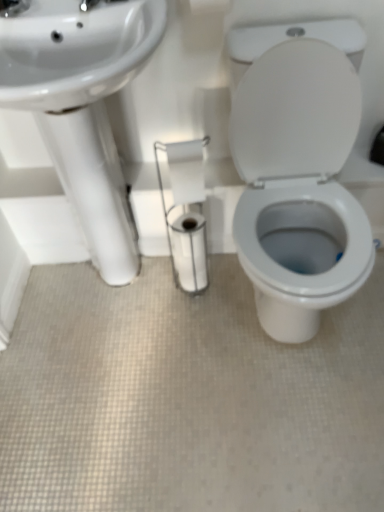
Locate an element on the screen. white glossy toilet paper at center, which ranks as the 2th toilet paper in top-to-bottom order is located at coordinates [x=186, y=170].

The width and height of the screenshot is (384, 512). What do you see at coordinates (186, 170) in the screenshot?
I see `white glossy toilet paper at center, the 1th toilet paper positioned from the bottom` at bounding box center [186, 170].

You are a GUI agent. You are given a task and a screenshot of the screen. Output one action in this format:
    pyautogui.click(x=<x>, y=<y>)
    Task: Click on the white matte toilet paper at upper center, which appears as the second toilet paper when ordered from the bottom
    
    Given the screenshot: What is the action you would take?
    pyautogui.click(x=209, y=6)

Describe the element at coordinates (81, 104) in the screenshot. I see `white glossy sink at left` at that location.

Find the location of a particular element. Image resolution: width=384 pixels, height=512 pixels. white glossy toilet paper at center, the 1th toilet paper positioned from the bottom is located at coordinates (186, 170).

From a real-world perspective, which is physically below, white matte toilet paper at upper center, which appears as the second toilet paper when ordered from the bottom, or white glossy porcelain at center?

white glossy porcelain at center is physically lower.

In the scene shown: Is white matte toilet paper at upper center, which appears as the second toilet paper when ordered from the bottom, in front of or behind white glossy porcelain at center in the image?

In the image, white matte toilet paper at upper center, which appears as the second toilet paper when ordered from the bottom, appears behind white glossy porcelain at center.

Which object is wider, white matte toilet paper at upper center, which appears as the second toilet paper when ordered from the bottom, or white glossy porcelain at center?

With larger width is white glossy porcelain at center.

From the image's perspective, is white matte toilet paper at upper center, which appears as the second toilet paper when ordered from the bottom, above white glossy porcelain at center?

Yes.

Can you see white glossy porcelain at center touching white glossy toilet paper at center, the 1th toilet paper positioned from the bottom?

No, white glossy porcelain at center is not with white glossy toilet paper at center, the 1th toilet paper positioned from the bottom.

Is point (335, 234) positioned in front of point (180, 144)?

No, (335, 234) is behind (180, 144).

Does white glossy porcelain at center have a larger size compared to white glossy toilet paper at center, which ranks as the 2th toilet paper in top-to-bottom order?

Indeed, white glossy porcelain at center has a larger size compared to white glossy toilet paper at center, which ranks as the 2th toilet paper in top-to-bottom order.

Which is correct: white glossy sink at left is inside white glossy toilet paper at center, which ranks as the 2th toilet paper in top-to-bottom order, or outside of it?

white glossy sink at left is spatially situated outside white glossy toilet paper at center, which ranks as the 2th toilet paper in top-to-bottom order.

How much distance is there between white glossy sink at left and white glossy toilet paper at center, the 1th toilet paper positioned from the bottom?

white glossy sink at left and white glossy toilet paper at center, the 1th toilet paper positioned from the bottom, are 11.16 inches apart from each other.

Where is `the 1st toilet paper to the right of the white glossy sink at left, counting from the anchor's position`? the 1st toilet paper to the right of the white glossy sink at left, counting from the anchor's position is located at coordinates (186, 170).

Consider the image. Is white glossy sink at left next to white glossy toilet paper at center, the 1th toilet paper positioned from the bottom?

No, white glossy sink at left is not next to white glossy toilet paper at center, the 1th toilet paper positioned from the bottom.

Would you consider white glossy toilet paper at center, the 1th toilet paper positioned from the bottom, to be distant from white matte toilet paper at upper center, the 1th toilet paper when ordered from top to bottom?

No.

Which of these two, white glossy toilet paper at center, which ranks as the 2th toilet paper in top-to-bottom order, or white matte toilet paper at upper center, which appears as the second toilet paper when ordered from the bottom, is thinner?

white glossy toilet paper at center, which ranks as the 2th toilet paper in top-to-bottom order.

Considering the positions of point (271, 182) and point (111, 141), is point (271, 182) closer or farther from the camera than point (111, 141)?

Point (271, 182) is closer to the camera than point (111, 141).

Is white glossy porcelain at center shorter than white glossy sink at left?

Correct, white glossy porcelain at center is not as tall as white glossy sink at left.

From the picture: From a real-world perspective, is white glossy porcelain at center physically located above or below white glossy sink at left?

In terms of real-world spatial position, white glossy porcelain at center is below white glossy sink at left.

Is white matte toilet paper at upper center, which appears as the second toilet paper when ordered from the bottom, at the right side of white glossy toilet paper at center, which ranks as the 2th toilet paper in top-to-bottom order?

Yes.

From the image's perspective, does white matte toilet paper at upper center, the 1th toilet paper when ordered from top to bottom, appear lower than white glossy toilet paper at center, the 1th toilet paper positioned from the bottom?

No.

Is white matte toilet paper at upper center, the 1th toilet paper when ordered from top to bottom, in front of or behind white glossy toilet paper at center, the 1th toilet paper positioned from the bottom, in the image?

Visually, white matte toilet paper at upper center, the 1th toilet paper when ordered from top to bottom, is located in front of white glossy toilet paper at center, the 1th toilet paper positioned from the bottom.

Can you confirm if white matte toilet paper at upper center, which appears as the second toilet paper when ordered from the bottom, is shorter than white glossy toilet paper at center, the 1th toilet paper positioned from the bottom?

Yes.

Which is in front, point (200, 5) or point (16, 69)?

The point (16, 69) is closer to the camera.

Considering the relative positions of white matte toilet paper at upper center, which appears as the second toilet paper when ordered from the bottom, and white glossy sink at left in the image provided, is white matte toilet paper at upper center, which appears as the second toilet paper when ordered from the bottom, to the left of white glossy sink at left from the viewer's perspective?

No, white matte toilet paper at upper center, which appears as the second toilet paper when ordered from the bottom, is not to the left of white glossy sink at left.

From a real-world perspective, between white matte toilet paper at upper center, which appears as the second toilet paper when ordered from the bottom, and white glossy sink at left, who is vertically lower?

From a 3D spatial view, white glossy sink at left is below.

Where is `toilet paper above the white glossy sink at left (from the image's perspective)`? toilet paper above the white glossy sink at left (from the image's perspective) is located at coordinates (209, 6).

Find the location of a particular element. The image size is (384, 512). porcelain that is below the white matte toilet paper at upper center, the 1th toilet paper when ordered from top to bottom (from the image's perspective) is located at coordinates (298, 184).

Find the location of a particular element. the 1st toilet paper located above the white glossy porcelain at center (from a real-world perspective) is located at coordinates (186, 170).

Considering their positions, is white matte toilet paper at upper center, the 1th toilet paper when ordered from top to bottom, positioned further to white glossy porcelain at center than white glossy sink at left?

The object further to white glossy porcelain at center is white matte toilet paper at upper center, the 1th toilet paper when ordered from top to bottom.

From the picture: Looking at the image, which one is located further to white glossy toilet paper at center, the 1th toilet paper positioned from the bottom, white glossy porcelain at center or white matte toilet paper at upper center, the 1th toilet paper when ordered from top to bottom?

The object further to white glossy toilet paper at center, the 1th toilet paper positioned from the bottom, is white matte toilet paper at upper center, the 1th toilet paper when ordered from top to bottom.

Considering their positions, is white matte toilet paper at upper center, the 1th toilet paper when ordered from top to bottom, positioned further to white glossy porcelain at center than white glossy toilet paper at center, the 1th toilet paper positioned from the bottom?

white matte toilet paper at upper center, the 1th toilet paper when ordered from top to bottom.

When comparing their distances from white matte toilet paper at upper center, the 1th toilet paper when ordered from top to bottom, does white glossy toilet paper at center, the 1th toilet paper positioned from the bottom, or white glossy porcelain at center seem further?

Based on the image, white glossy porcelain at center appears to be further to white matte toilet paper at upper center, the 1th toilet paper when ordered from top to bottom.

Estimate the real-world distances between objects in this image. Which object is closer to white glossy porcelain at center, white glossy toilet paper at center, the 1th toilet paper positioned from the bottom, or white matte toilet paper at upper center, the 1th toilet paper when ordered from top to bottom?

white glossy toilet paper at center, the 1th toilet paper positioned from the bottom.

Based on their spatial positions, is white glossy sink at left or white glossy porcelain at center closer to white glossy toilet paper at center, the 1th toilet paper positioned from the bottom?

Based on the image, white glossy sink at left appears to be nearer to white glossy toilet paper at center, the 1th toilet paper positioned from the bottom.

From the image, which object appears to be farther from white glossy porcelain at center, white glossy sink at left or white glossy toilet paper at center, which ranks as the 2th toilet paper in top-to-bottom order?

white glossy sink at left is positioned further to the anchor white glossy porcelain at center.

Based on their spatial positions, is white matte toilet paper at upper center, the 1th toilet paper when ordered from top to bottom, or white glossy porcelain at center further from white glossy toilet paper at center, the 1th toilet paper positioned from the bottom?

white matte toilet paper at upper center, the 1th toilet paper when ordered from top to bottom.

Identify the location of sink between white matte toilet paper at upper center, which appears as the second toilet paper when ordered from the bottom, and white glossy toilet paper at center, which ranks as the 2th toilet paper in top-to-bottom order, vertically. (81, 104).

The image size is (384, 512). In order to click on toilet paper between white matte toilet paper at upper center, the 1th toilet paper when ordered from top to bottom, and white glossy porcelain at center vertically in this screenshot , I will do `click(186, 170)`.